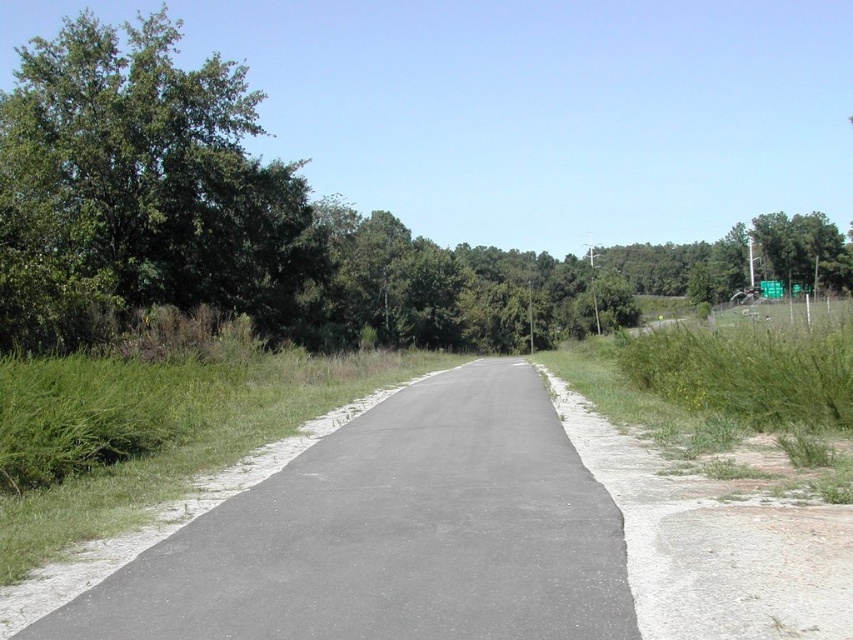
You are a cyclist planning to ride along the gray asphalt path at center. You notice the green metallic sign at upper right ahead. Which object will you encounter first as you move forward?

The gray asphalt path at center is shorter than the green metallic sign at upper right, so you will encounter the gray asphalt path at center first.

You are a cyclist approaching the green leafy tree at left and the green metallic sign at upper right. Which object will you see first as you move forward along the road?

You will see the green leafy tree at left first because it is positioned to the left of the green metallic sign at upper right, meaning it is closer to the cyclist as they move forward along the road.

You are standing at the origin point of the image. Where is the gray asphalt path at center located?

The gray asphalt path at center is located at point (392, 534).